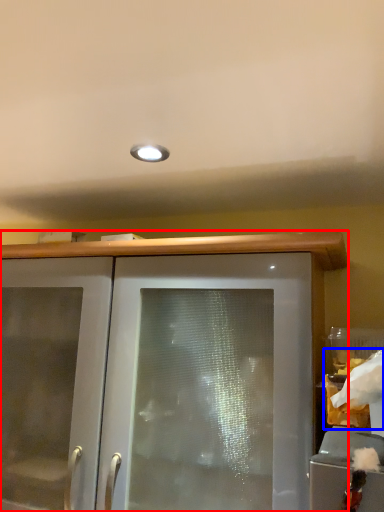
Question: Which point is further to the camera, cabinetry (highlighted by a red box) or food (highlighted by a blue box)?

Choices:
 (A) cabinetry
 (B) food

Answer: (A)